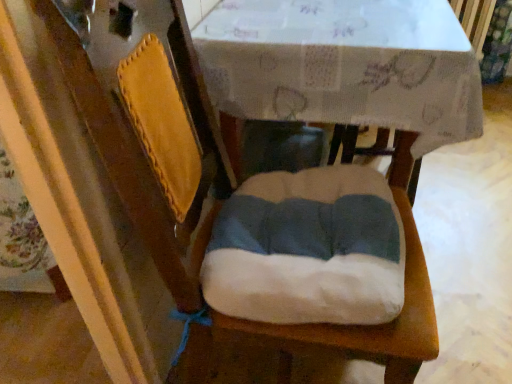
The image size is (512, 384). I want to click on white fabric cushion at center, so [x=376, y=326].

The height and width of the screenshot is (384, 512). What do you see at coordinates (376, 326) in the screenshot?
I see `white fabric cushion at center` at bounding box center [376, 326].

Find the location of a particular element. The height and width of the screenshot is (384, 512). white paper at center is located at coordinates (345, 66).

Describe the element at coordinates (345, 66) in the screenshot. This screenshot has width=512, height=384. I see `white paper at center` at that location.

Where is `white fabric cushion at center`? white fabric cushion at center is located at coordinates (376, 326).

Would you say white fabric cushion at center is to the left or to the right of white paper at center in the picture?

white fabric cushion at center is positioned on white paper at center's right side.

Relative to white paper at center, is white fabric cushion at center in front or behind?

white fabric cushion at center is behind white paper at center.

Which is behind, point (161, 114) or point (290, 110)?

The point (290, 110) is behind.

From the image's perspective, between white fabric cushion at center and white paper at center, which one is located above?

white paper at center.

From a real-world perspective, is white fabric cushion at center below white paper at center?

Correct, in the physical world, white fabric cushion at center is lower than white paper at center.

Does white fabric cushion at center have a greater width compared to white paper at center?

Correct, the width of white fabric cushion at center exceeds that of white paper at center.

Considering the sizes of white fabric cushion at center and white paper at center in the image, is white fabric cushion at center taller or shorter than white paper at center?

Considering their sizes, white fabric cushion at center has less height than white paper at center.

Can you confirm if white fabric cushion at center is bigger than white paper at center?

No.

From the picture: Is white fabric cushion at center spatially inside white paper at center, or outside of it?

white fabric cushion at center is not inside white paper at center, it's outside.

Is the surface of white fabric cushion at center in direct contact with white paper at center?

white fabric cushion at center and white paper at center are not in contact.

Is white fabric cushion at center turned away from white paper at center?

No, white fabric cushion at center is not facing the opposite direction of white paper at center.

Looking at this image, what's the angular difference between white fabric cushion at center and white paper at center's facing directions?

They differ by 87.9 degrees in their facing directions.

I want to click on round table positioned vertically above the white fabric cushion at center (from a real-world perspective), so click(345, 66).

Which object is positioned more to the left, white paper at center or white fabric cushion at center?

From the viewer's perspective, white paper at center appears more on the left side.

Is white paper at center closer to camera compared to white fabric cushion at center?

Yes, white paper at center is closer to the viewer.

Considering the points (411, 195) and (419, 301), which point is in front, point (411, 195) or point (419, 301)?

The point (419, 301) is in front.

From the image's perspective, is white paper at center above or below white fabric cushion at center?

Clearly, from the image's perspective, white paper at center is above white fabric cushion at center.

From a real-world perspective, is white paper at center under white fabric cushion at center?

No, from a real-world perspective, white paper at center is not under white fabric cushion at center.

Does white paper at center have a greater width compared to white fabric cushion at center?

Incorrect, the width of white paper at center does not surpass that of white fabric cushion at center.

Can you confirm if white paper at center is taller than white fabric cushion at center?

Yes, white paper at center is taller than white fabric cushion at center.

Can you confirm if white paper at center is bigger than white fabric cushion at center?

Yes.

Can we say white paper at center lies outside white fabric cushion at center?

Yes, white paper at center is outside of white fabric cushion at center.

Does white paper at center touch white fabric cushion at center?

No, white paper at center is not with white fabric cushion at center.

Is white paper at center turned away from white fabric cushion at center?

white paper at center is not turned away from white fabric cushion at center.

How many degrees apart are the facing directions of white paper at center and white fabric cushion at center?

There is a 87.9-degree angle between the facing directions of white paper at center and white fabric cushion at center.

This screenshot has height=384, width=512. Find the location of `round table that appears in front of the white fabric cushion at center`. round table that appears in front of the white fabric cushion at center is located at coordinates (345, 66).

I want to click on chair that is below the white paper at center (from the image's perspective), so 376,326.

I want to click on chair behind the white paper at center, so click(376, 326).